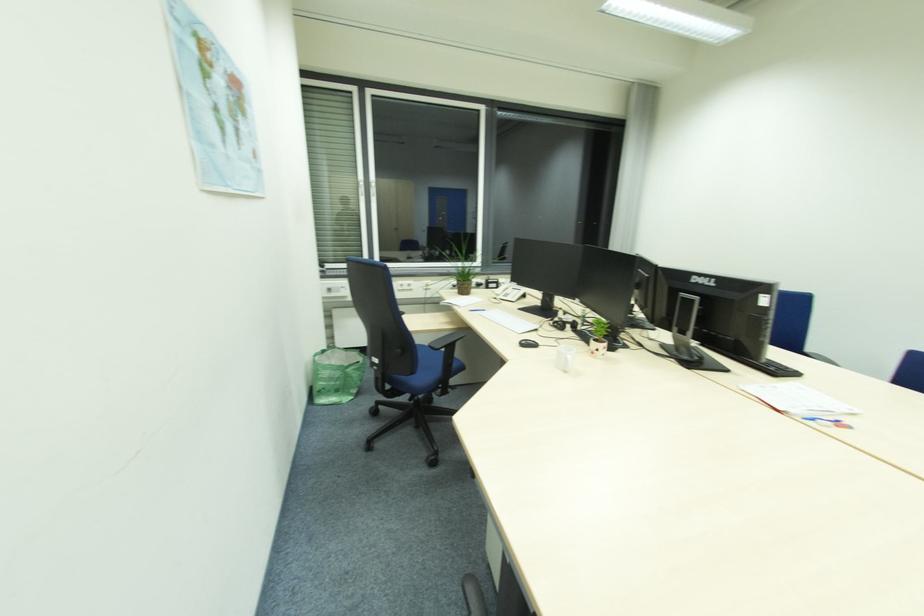
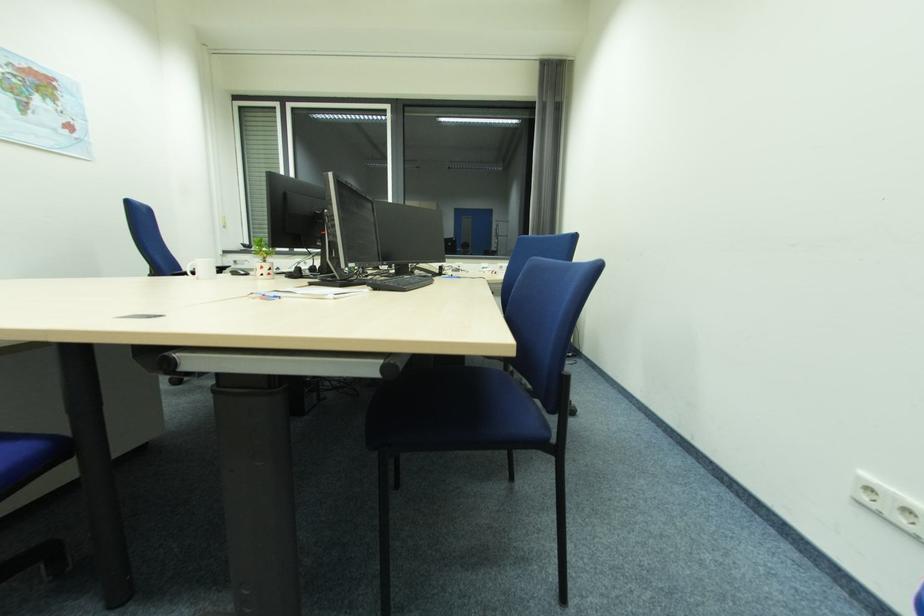
Question: In a continuous first-person perspective shot, in which direction is the camera moving?

Choices:
 (A) Left
 (B) Right
 (C) Forward
 (D) Backward

Answer: (B)